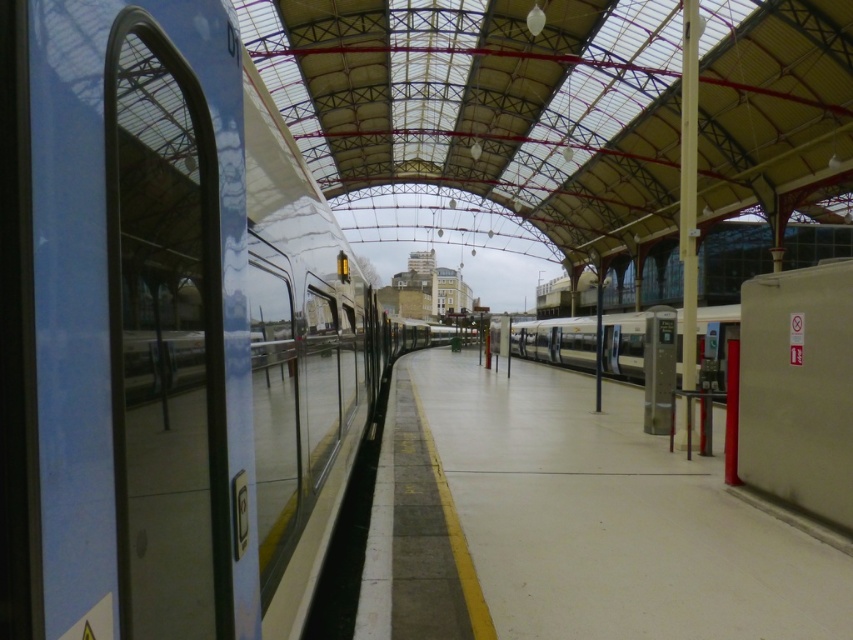
Is polished silver train at center wider than silver metallic train at center?

In fact, polished silver train at center might be narrower than silver metallic train at center.

Which is in front, point (9, 228) or point (724, 307)?

Point (9, 228)

This screenshot has height=640, width=853. Identify the location of polished silver train at center. pos(166,332).